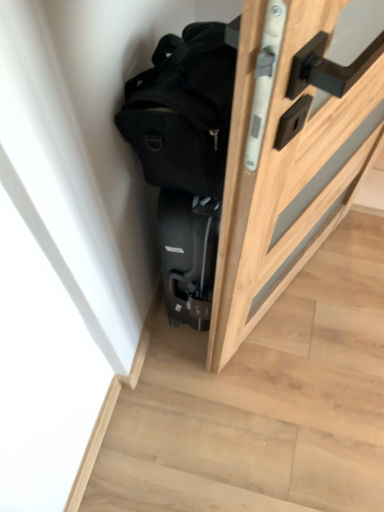
Question: From a real-world perspective, is black suitcase at lower left positioned above or below black matte backpack at upper center?

Choices:
 (A) above
 (B) below

Answer: (B)

Question: Is point (352, 275) closer or farther from the camera than point (153, 158)?

Choices:
 (A) farther
 (B) closer

Answer: (A)

Question: Which of these objects is positioned farthest from the black matte backpack at upper center?

Choices:
 (A) black suitcase at lower left
 (B) wooden door at right

Answer: (A)

Question: Estimate the real-world distances between objects in this image. Which object is farther from the black matte backpack at upper center?

Choices:
 (A) black suitcase at lower left
 (B) wooden door at right

Answer: (A)